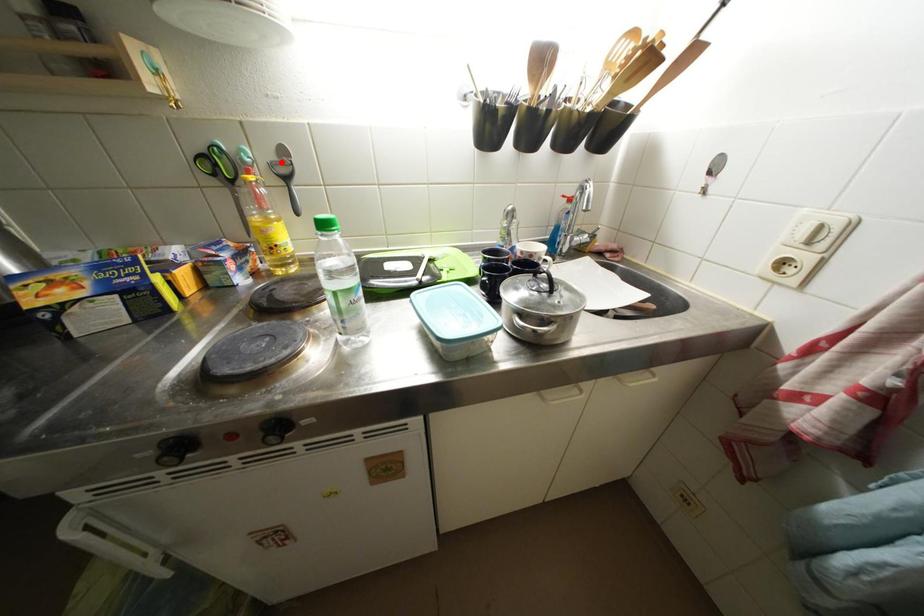
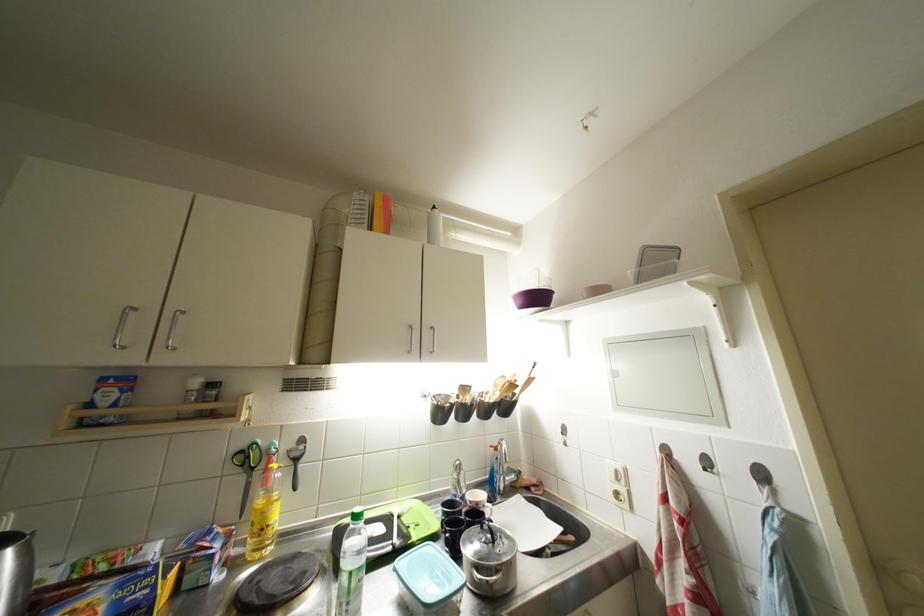
Locate, in the second image, the point that corresponds to the highlighted location in the first image.

(299, 450)